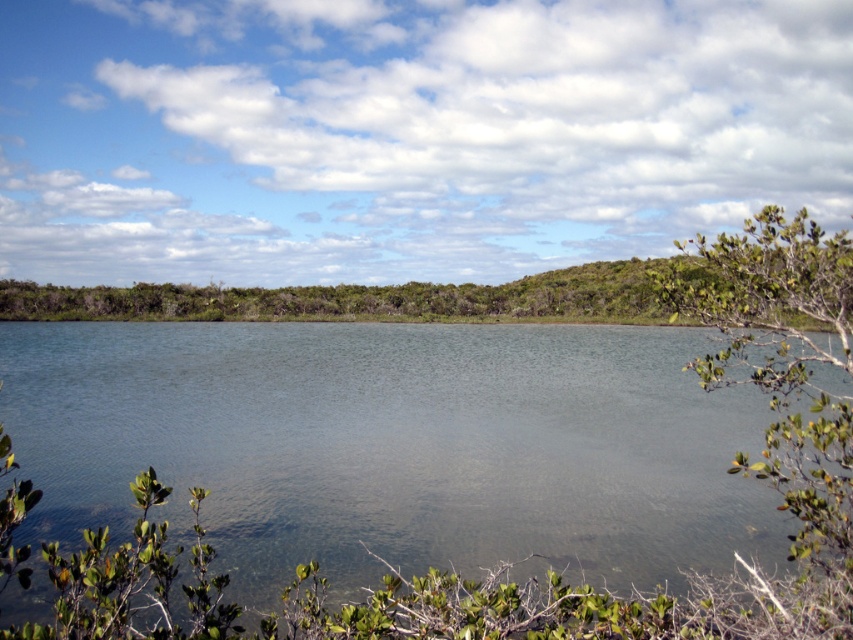
Consider the image. You are standing at the edge of the clear water at center and want to reach the green leafy shrub at right. Which direction should you walk to get closer to the shrub?

You should walk towards the right because the green leafy shrub at right is located to the right side of the clear water at center.

You are standing at the edge of the water in the serene landscape scene. You see two points marked in the image. Which point, point (666, 477) or point (795, 376), is closer to you?

Point (795, 376) is closer to you because it is less further to the camera than point (666, 477).

Consider the image. You are a landscape architect designing a walking path that needs to pass between the clear water at center and the green leafy shrub at right. The path must be at least 20 meters long to accommodate a scenic walkway. Can the existing space between them support this requirement?

The distance between the clear water at center and the green leafy shrub at right is 21.27 meters, which is longer than the required 20 meters. Therefore, the existing space can support the 20 meter path length requirement.